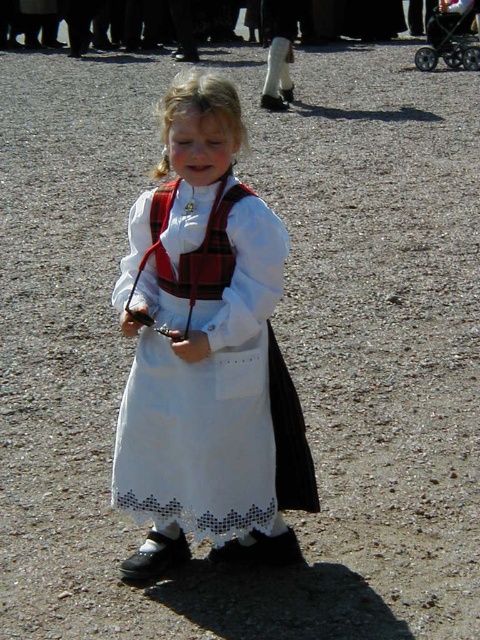
You are a photographer trying to capture the girl in the scene. You notice two points marked in the image. The first point is at coordinate point (207, 289) and the second is at point (434, 49). Which point is closer to the girl?

Point (207, 289) is in front of point (434, 49), so it is closer to the girl.

You are a photographer trying to capture the girl in the white cotton dress at center and the black plastic baby carriage at upper right in the same frame. Based on their positions, which object is closer to the bottom edge of the photo?

The white cotton dress at center is closer to the bottom edge of the photo because it is positioned below the black plastic baby carriage at upper right.

You are a photographer setting up for a group photo. You need to ensure that the white cotton dress at center and the black plastic baby carriage at upper right are both visible in the frame. Based on their sizes, which one might require more space in the composition?

The black plastic baby carriage at upper right requires more space in the composition because its width is greater than the white cotton dress at center.